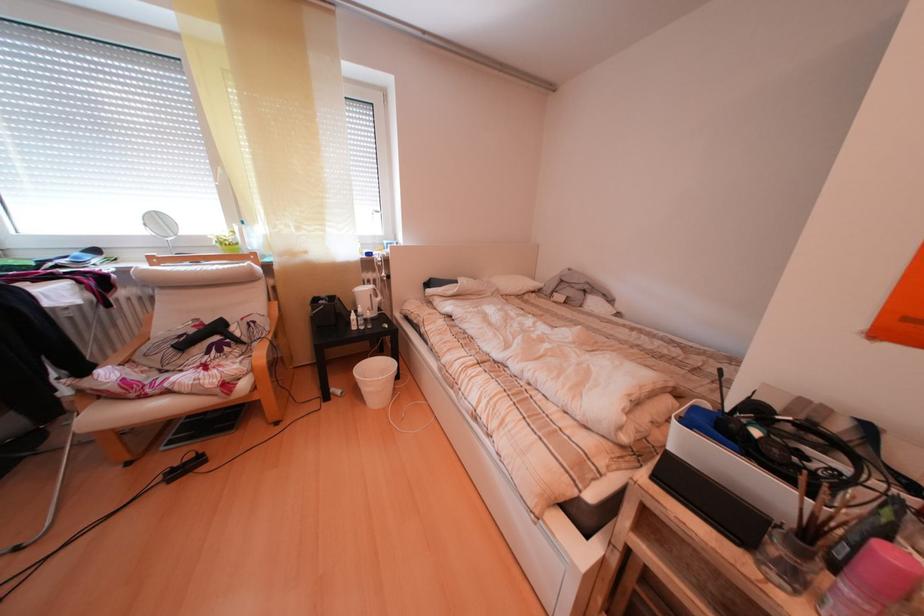
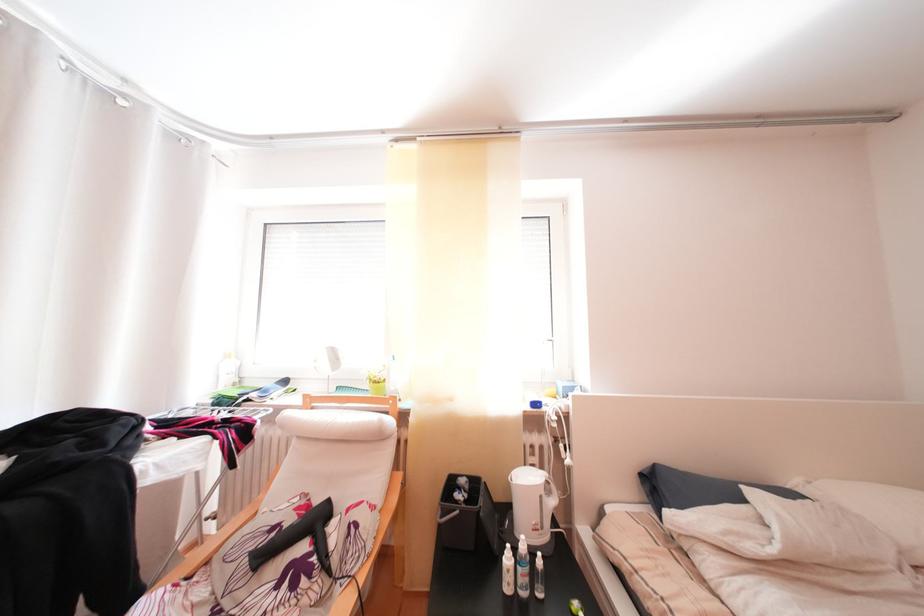
Find the pixel in the second image that matches point 205,336 in the first image.

(301, 525)